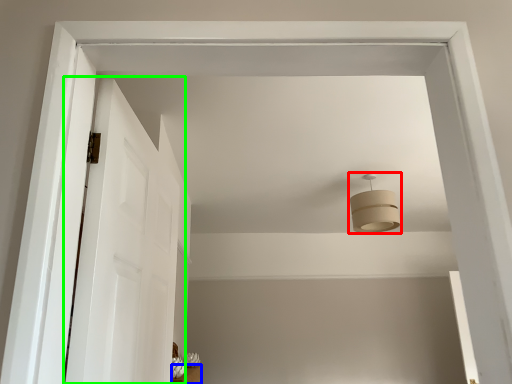
Question: Which object is the closest to the fixture (highlighted by a red box)? Choose among these: furniture (highlighted by a blue box) or door (highlighted by a green box).

Choices:
 (A) furniture
 (B) door

Answer: (B)